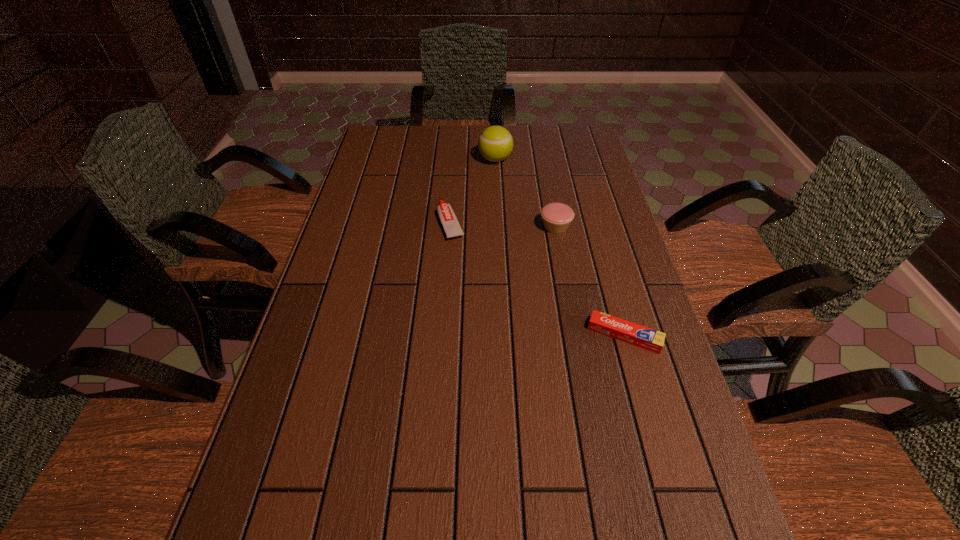
Locate an element on the screen. The image size is (960, 540). the farthest object is located at coordinates (495, 144).

Locate an element on the screen. Image resolution: width=960 pixels, height=540 pixels. the tallest object is located at coordinates (495, 144).

Locate an element on the screen. The height and width of the screenshot is (540, 960). the second tallest object is located at coordinates (556, 217).

This screenshot has height=540, width=960. I want to click on the taller toothpaste, so click(x=452, y=228).

Identify the location of the second shortest object. 452,228.

I want to click on the shorter toothpaste, so click(631, 333).

Where is `the right toothpaste`? the right toothpaste is located at coordinates (631, 333).

Locate an element on the screen. The width and height of the screenshot is (960, 540). vacant space situated on the right of the second object from left to right is located at coordinates (541, 159).

Where is `free region located on the back of the cupcake`? This screenshot has height=540, width=960. free region located on the back of the cupcake is located at coordinates (544, 163).

Locate an element on the screen. This screenshot has height=540, width=960. vacant position located 0.090m on the left of the second shortest object is located at coordinates (405, 224).